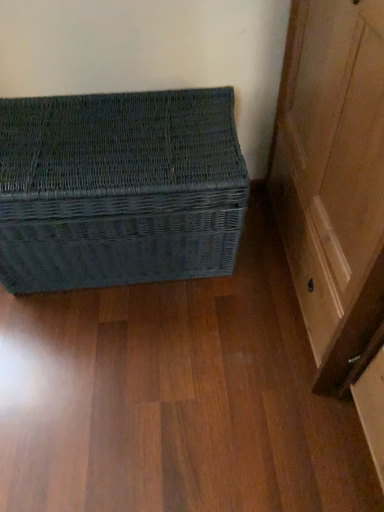
Identify the location of woven dark blue chest at lower left. (119, 189).

This screenshot has width=384, height=512. Describe the element at coordinates (119, 189) in the screenshot. I see `woven dark blue chest at lower left` at that location.

Measure the distance between woven dark blue chest at lower left and camera.

The depth of woven dark blue chest at lower left is 1.11 meters.

In order to face woven dark blue chest at lower left, should I rotate leftwards or rightwards?

You should rotate left by 10.060 degrees.

Where is `woven dark blue chest at lower left`? Image resolution: width=384 pixels, height=512 pixels. woven dark blue chest at lower left is located at coordinates (119, 189).